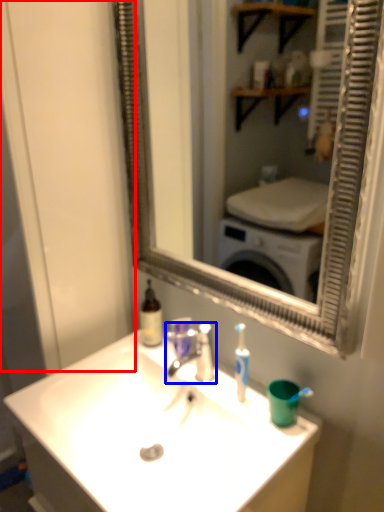
Question: Which of the following is the closest to the observer, glass door (highlighted by a red box) or tap (highlighted by a blue box)?

Choices:
 (A) glass door
 (B) tap

Answer: (A)